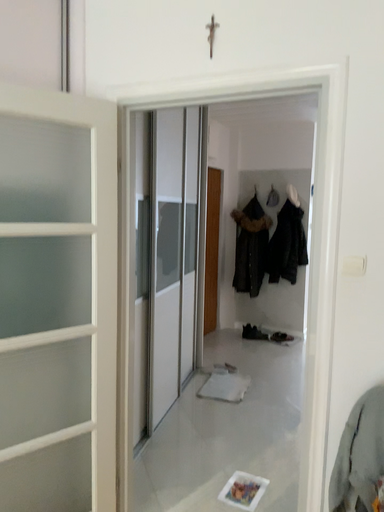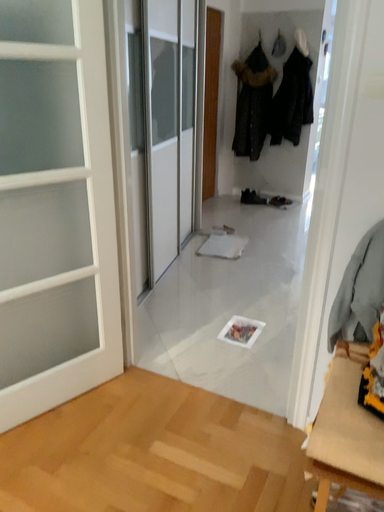
Question: Which way did the camera rotate in the video?

Choices:
 (A) rotated downward
 (B) rotated upward

Answer: (A)